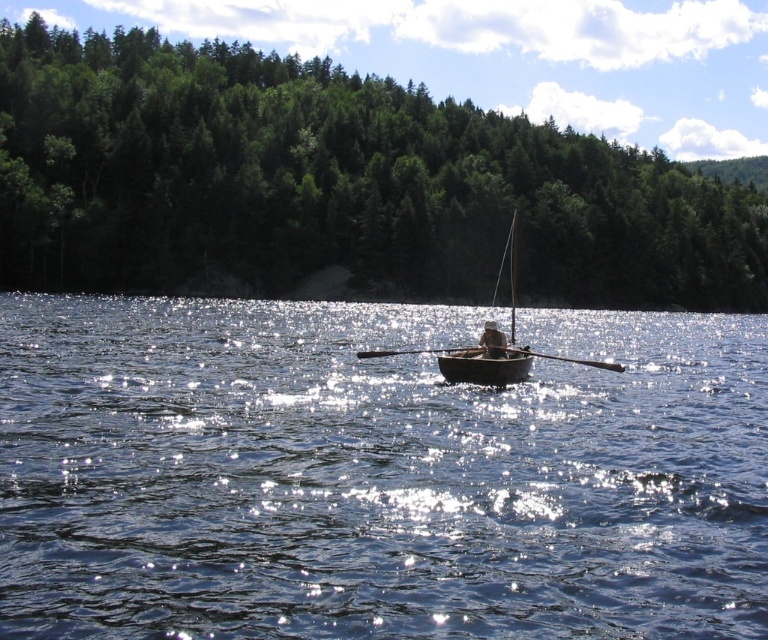
Based on the photo, does green leafy trees at center have a lesser width compared to gray fabric person at center?

Incorrect, green leafy trees at center's width is not less than gray fabric person at center's.

Can you confirm if green leafy trees at center is positioned below gray fabric person at center?

No.

Image resolution: width=768 pixels, height=640 pixels. I want to click on green leafy trees at center, so click(x=333, y=184).

The width and height of the screenshot is (768, 640). I want to click on green leafy trees at center, so click(333, 184).

Does point (373, 202) come closer to viewer compared to point (485, 378)?

No.

Does green leafy trees at center have a greater height compared to wooden canoe at center?

Correct, green leafy trees at center is much taller as wooden canoe at center.

Does point (336, 224) lie behind point (442, 355)?

Yes, it is behind point (442, 355).

Find the location of a particular element. green leafy trees at center is located at coordinates (333, 184).

Which is above, wooden at center or gray fabric person at center?

gray fabric person at center

Can you confirm if wooden at center is wider than gray fabric person at center?

Yes, wooden at center is wider than gray fabric person at center.

Find the location of a particular element. The height and width of the screenshot is (640, 768). wooden at center is located at coordinates (561, 358).